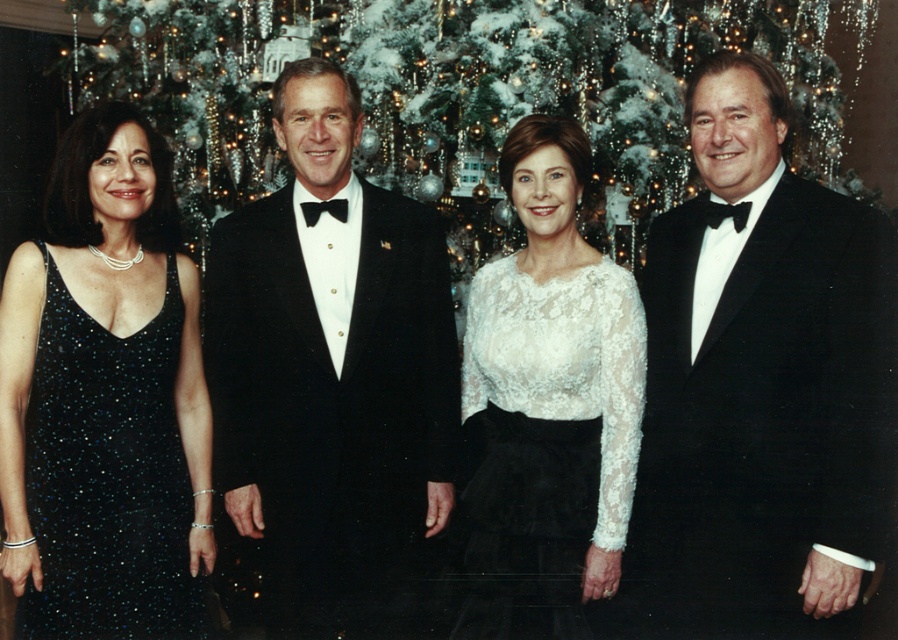
Does black satin tuxedo at right come behind sparkly black dress at left?

No, it is in front of sparkly black dress at left.

Between black satin tuxedo at right and sparkly black dress at left, which one is positioned lower?

sparkly black dress at left

Locate an element on the screen. This screenshot has height=640, width=898. black satin tuxedo at right is located at coordinates (762, 381).

Find the location of a particular element. black satin tuxedo at right is located at coordinates (762, 381).

Which is in front, point (857, 449) or point (315, 195)?

Point (857, 449) is in front.

Image resolution: width=898 pixels, height=640 pixels. Describe the element at coordinates (762, 381) in the screenshot. I see `black satin tuxedo at right` at that location.

Find the location of a particular element. Image resolution: width=898 pixels, height=640 pixels. black satin tuxedo at right is located at coordinates (762, 381).

Which is more to the right, white lace blouse at center or sparkly black dress at left?

white lace blouse at center is more to the right.

The width and height of the screenshot is (898, 640). In order to click on white lace blouse at center in this screenshot , I will do `click(547, 404)`.

The height and width of the screenshot is (640, 898). Identify the location of white lace blouse at center. (547, 404).